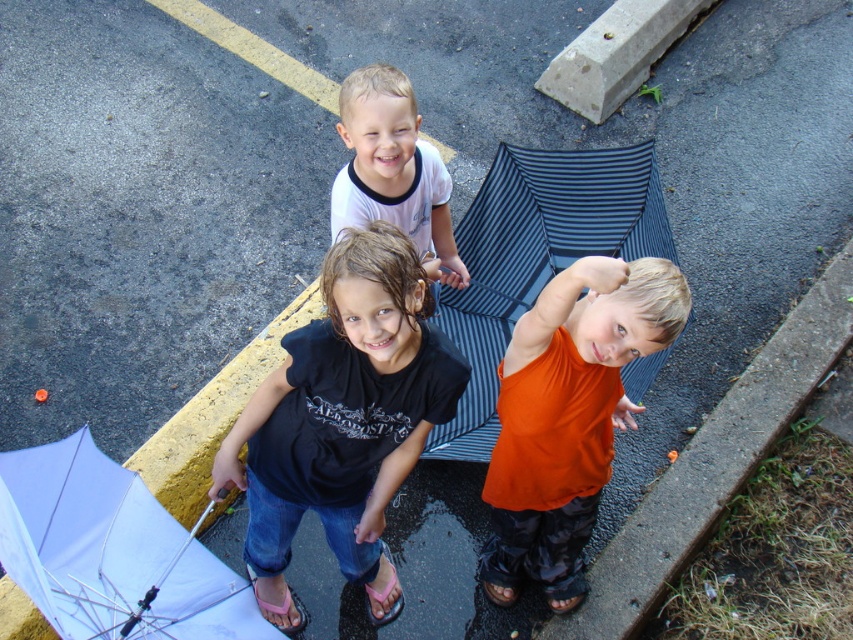
Which is above, pink fabric sandal at lower center or brown leather sandal at lower center?

pink fabric sandal at lower center is higher up.

Does pink fabric sandal at lower center appear over brown leather sandal at lower center?

Indeed, pink fabric sandal at lower center is positioned over brown leather sandal at lower center.

Does point (265, 609) lie behind point (514, 595)?

No, (265, 609) is closer to viewer.

Locate an element on the screen. This screenshot has width=853, height=640. pink fabric sandal at lower center is located at coordinates (281, 605).

Which of these two, white matte umbrella at lower left or brown leather sandal at lower center, stands taller?

white matte umbrella at lower left

Who is higher up, white matte umbrella at lower left or brown leather sandal at lower center?

white matte umbrella at lower left

Identify the location of white matte umbrella at lower left. (109, 552).

Does white matte umbrella at lower left appear over pink rubber sandal at lower center?

Correct, white matte umbrella at lower left is located above pink rubber sandal at lower center.

Is white matte umbrella at lower left further to the viewer compared to pink rubber sandal at lower center?

No, white matte umbrella at lower left is closer to the viewer.

You are a GUI agent. You are given a task and a screenshot of the screen. Output one action in this format:
    pyautogui.click(x=<x>, y=<y>)
    Task: Click on the white matte umbrella at lower left
    Image resolution: width=853 pixels, height=640 pixels.
    Given the screenshot: What is the action you would take?
    pyautogui.click(x=109, y=552)